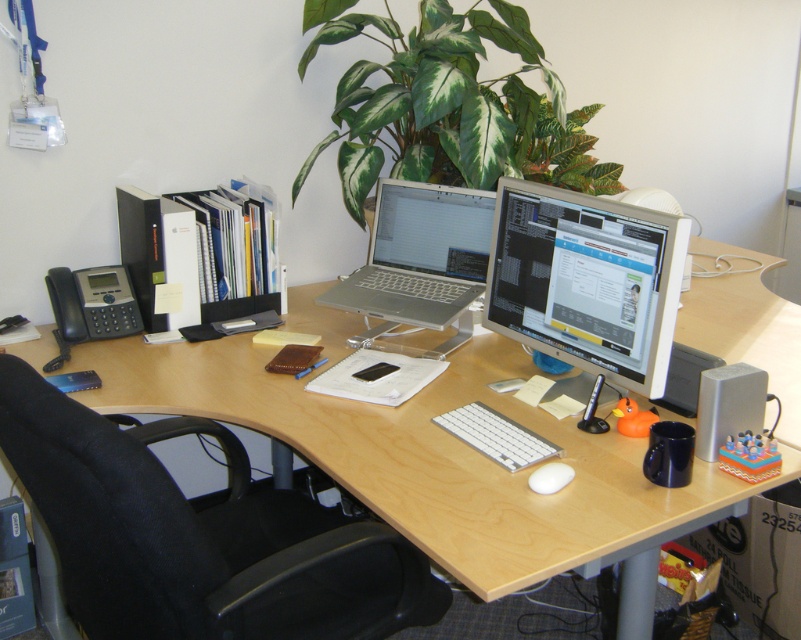
Between point (131, 385) and point (465, 200), which one is positioned in front?

Point (131, 385) is in front.

Measure the distance between light wood computer desk at center and camera.

A distance of 3.81 feet exists between light wood computer desk at center and camera.

Is point (505, 570) positioned behind point (441, 269)?

No, (505, 570) is in front of (441, 269).

Where is `light wood computer desk at center`? Image resolution: width=801 pixels, height=640 pixels. light wood computer desk at center is located at coordinates (475, 451).

Can you confirm if light wood computer desk at center is thinner than green leafy plant at upper center?

In fact, light wood computer desk at center might be wider than green leafy plant at upper center.

Does light wood computer desk at center appear over green leafy plant at upper center?

No.

Is point (799, 365) positioned before point (449, 58)?

Yes, it is in front of point (449, 58).

The height and width of the screenshot is (640, 801). What are the coordinates of `light wood computer desk at center` in the screenshot? It's located at (475, 451).

Is green leafy plant at upper center below white matte mouse at center?

No, green leafy plant at upper center is not below white matte mouse at center.

Is green leafy plant at upper center thinner than white matte mouse at center?

Incorrect, green leafy plant at upper center's width is not less than white matte mouse at center's.

The width and height of the screenshot is (801, 640). What do you see at coordinates (449, 106) in the screenshot?
I see `green leafy plant at upper center` at bounding box center [449, 106].

At what (x,y) coordinates should I click in order to perform the action: click on green leafy plant at upper center. Please return your answer as a coordinate pair (x, y). This screenshot has width=801, height=640. Looking at the image, I should click on (449, 106).